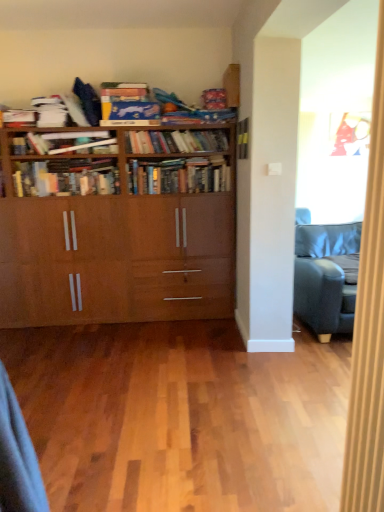
Question: From the image's perspective, is hardcover books at center, the 2th book positioned from the bottom, above or below wooden bookcase at center?

Choices:
 (A) above
 (B) below

Answer: (A)

Question: Based on their sizes in the image, would you say hardcover books at center, arranged as the 5th book when viewed from the top, is bigger or smaller than wooden bookcase at center?

Choices:
 (A) small
 (B) big

Answer: (A)

Question: Which is farther from the light brown wood floor at center?

Choices:
 (A) wooden bookcase at center
 (B) wooden bookshelf at center, which is the fifth book from bottom to top
 (C) hardcover books at center, acting as the 6th book starting from the top
 (D) blue cardboard book at upper center, acting as the first book starting from the top
 (E) matte white book at upper left, the fourth book from the bottom

Answer: (D)

Question: Which object is the closest to the wooden bookshelf at center, which is the fifth book from bottom to top?

Choices:
 (A) wooden bookcase at center
 (B) light brown wood floor at center
 (C) matte white book at upper left, the fourth book from the bottom
 (D) hardcover books at center, the 2th book positioned from the bottom
 (E) blue cardboard book at upper center, which ranks as the 6th book in bottom-to-top order

Answer: (D)